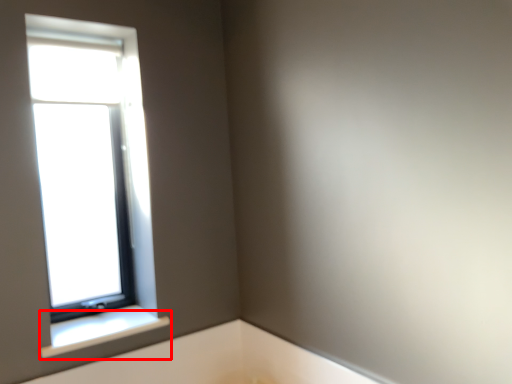
Question: From the image's perspective, where is window sill (annotated by the red box) located in relation to window in the image?

Choices:
 (A) above
 (B) below

Answer: (B)